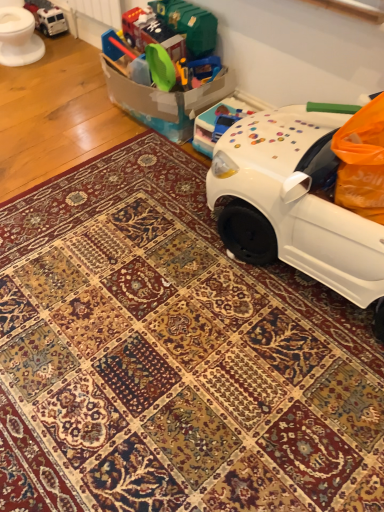
Question: Should I look upward or downward to see white glossy toilet bowl at upper left?

Choices:
 (A) down
 (B) up

Answer: (B)

Question: From the image's perspective, would you say metallic silver truck at upper left, which appears as the first toy when viewed from the left, is positioned over white glossy toilet bowl at upper left?

Choices:
 (A) yes
 (B) no

Answer: (A)

Question: Is metallic silver truck at upper left, placed as the second toy when sorted from bottom to top, located outside white glossy toilet bowl at upper left?

Choices:
 (A) no
 (B) yes

Answer: (B)

Question: Considering the relative sizes of metallic silver truck at upper left, which is counted as the 2th toy, starting from the right, and white glossy toilet bowl at upper left in the image provided, is metallic silver truck at upper left, which is counted as the 2th toy, starting from the right, thinner than white glossy toilet bowl at upper left?

Choices:
 (A) yes
 (B) no

Answer: (A)

Question: Is metallic silver truck at upper left, placed as the second toy when sorted from bottom to top, beside white glossy toilet bowl at upper left?

Choices:
 (A) yes
 (B) no

Answer: (B)

Question: Considering the relative sizes of metallic silver truck at upper left, which appears as the first toy when viewed from the left, and white glossy toilet bowl at upper left in the image provided, is metallic silver truck at upper left, which appears as the first toy when viewed from the left, taller than white glossy toilet bowl at upper left?

Choices:
 (A) no
 (B) yes

Answer: (A)

Question: From the image's perspective, would you say metallic silver truck at upper left, which appears as the first toy when viewed from the left, is shown under white glossy toilet bowl at upper left?

Choices:
 (A) yes
 (B) no

Answer: (B)

Question: Is white glossy toilet bowl at upper left located within translucent plastic toy car at upper right, which is the 1th toy in bottom-to-top order?

Choices:
 (A) no
 (B) yes

Answer: (A)

Question: From a real-world perspective, is translucent plastic toy car at upper right, arranged as the first toy when viewed from the right, on white glossy toilet bowl at upper left?

Choices:
 (A) no
 (B) yes

Answer: (A)

Question: From the image's perspective, is translucent plastic toy car at upper right, which is counted as the second toy, starting from the left, on white glossy toilet bowl at upper left?

Choices:
 (A) yes
 (B) no

Answer: (B)

Question: Is translucent plastic toy car at upper right, which is the 1th toy in bottom-to-top order, with white glossy toilet bowl at upper left?

Choices:
 (A) yes
 (B) no

Answer: (B)

Question: Is translucent plastic toy car at upper right, the 2th toy viewed from the back, wider than white glossy toilet bowl at upper left?

Choices:
 (A) yes
 (B) no

Answer: (B)

Question: Is translucent plastic toy car at upper right, which is the 1th toy in front-to-back order, outside white glossy toilet bowl at upper left?

Choices:
 (A) no
 (B) yes

Answer: (B)

Question: Is metallic silver truck at upper left, which appears as the first toy when viewed from the left, aimed at translucent plastic toy car at upper right, acting as the 2th toy starting from the top?

Choices:
 (A) yes
 (B) no

Answer: (B)